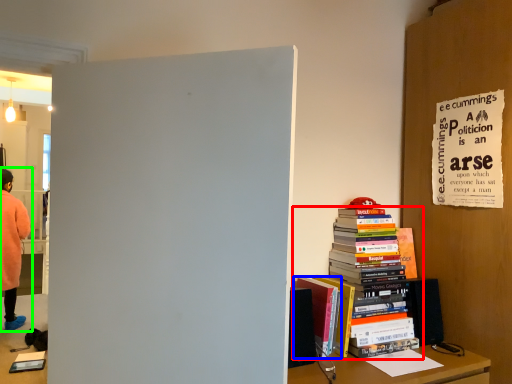
Question: Which is farther away from book (highlighted by a red box)? book (highlighted by a blue box) or person (highlighted by a green box)?

Choices:
 (A) book
 (B) person

Answer: (B)